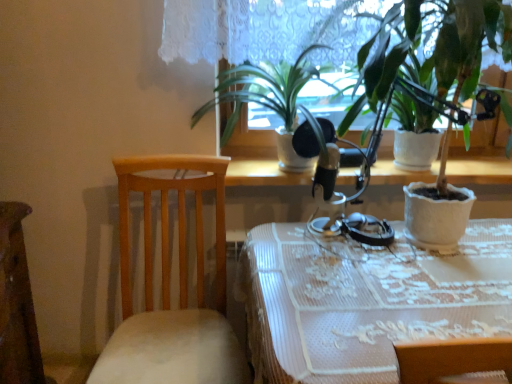
Question: Does white textured pot at right, which is the 2th houseplant from left to right, have a greater height compared to wooden chair at left?

Choices:
 (A) yes
 (B) no

Answer: (B)

Question: From the image's perspective, is white textured pot at right, which appears as the 1th houseplant when viewed from the right, beneath wooden chair at left?

Choices:
 (A) no
 (B) yes

Answer: (A)

Question: Is white textured pot at right, which is the 2th houseplant from left to right, thinner than wooden chair at left?

Choices:
 (A) no
 (B) yes

Answer: (B)

Question: Can you confirm if white textured pot at right, which appears as the 1th houseplant when viewed from the right, is positioned to the left of wooden chair at left?

Choices:
 (A) no
 (B) yes

Answer: (A)

Question: Are white textured pot at right, which appears as the 1th houseplant when viewed from the right, and wooden chair at left located far from each other?

Choices:
 (A) no
 (B) yes

Answer: (A)

Question: From a real-world perspective, is white textured pot at right, which appears as the 1th houseplant when viewed from the right, beneath wooden chair at left?

Choices:
 (A) no
 (B) yes

Answer: (A)

Question: Is the position of white textured pot at right, which appears as the 1th houseplant when viewed from the right, less distant than that of white lace tablecloth at center?

Choices:
 (A) yes
 (B) no

Answer: (B)

Question: Can you confirm if white textured pot at right, which appears as the 1th houseplant when viewed from the right, is positioned to the right of white lace tablecloth at center?

Choices:
 (A) yes
 (B) no

Answer: (A)

Question: From a real-world perspective, is white textured pot at right, which is the 2th houseplant from left to right, positioned over white lace tablecloth at center based on gravity?

Choices:
 (A) no
 (B) yes

Answer: (B)

Question: Does white textured pot at right, which is the 2th houseplant from left to right, have a greater height compared to white lace tablecloth at center?

Choices:
 (A) yes
 (B) no

Answer: (A)

Question: From the image's perspective, is white textured pot at right, which is the 2th houseplant from left to right, on white lace tablecloth at center?

Choices:
 (A) no
 (B) yes

Answer: (B)

Question: Is white textured pot at right, which appears as the 1th houseplant when viewed from the right, positioned far away from white lace tablecloth at center?

Choices:
 (A) yes
 (B) no

Answer: (B)

Question: Is white textured pot at right, which appears as the 1th houseplant when viewed from the right, at the right side of green matte plant at center, which is counted as the 2th houseplant, starting from the right?

Choices:
 (A) no
 (B) yes

Answer: (B)